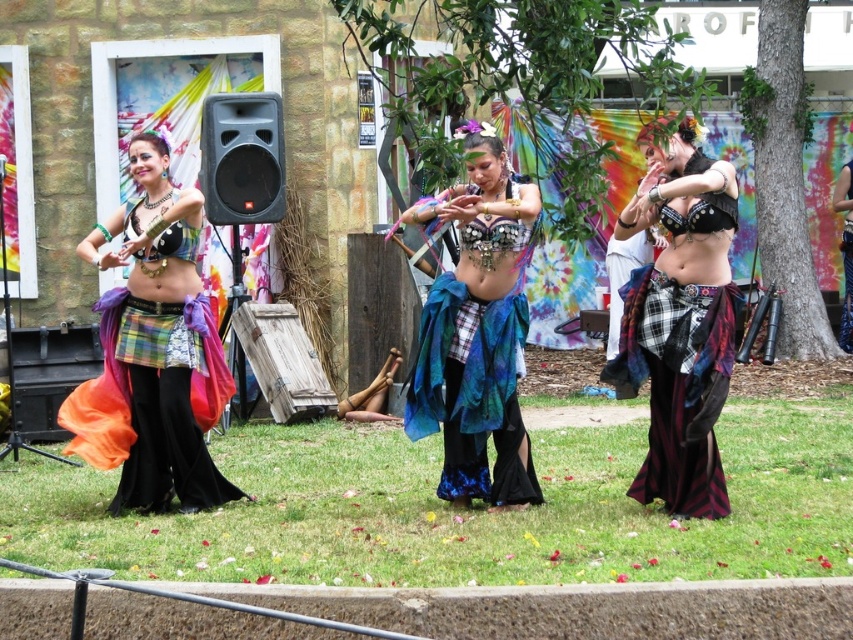
Based on the photo, you are a photographer trying to capture the central dancer in the image. You notice two skirts on her, the matte plaid skirt at center and the shiny blue fabric skirt at center. Which skirt should you focus on if you want to capture the wider one?

The matte plaid skirt at center is wider than the shiny blue fabric skirt at center, so you should focus on the matte plaid skirt at center to capture the wider one.

Based on the scene description, where is the matte plaid skirt at center located in the image?

The matte plaid skirt at center is located at point (154, 352) in the image.

You are a photographer at the performance. You want to capture a closeup shot of the plaid fabric skirt at center and the shiny blue fabric skirt at center. Which skirt should you focus on to ensure it fits within your camera frame without cropping?

The plaid fabric skirt at center has a smaller size compared to the shiny blue fabric skirt at center, so focusing on the plaid fabric skirt at center would ensure it fits within the camera frame without cropping.